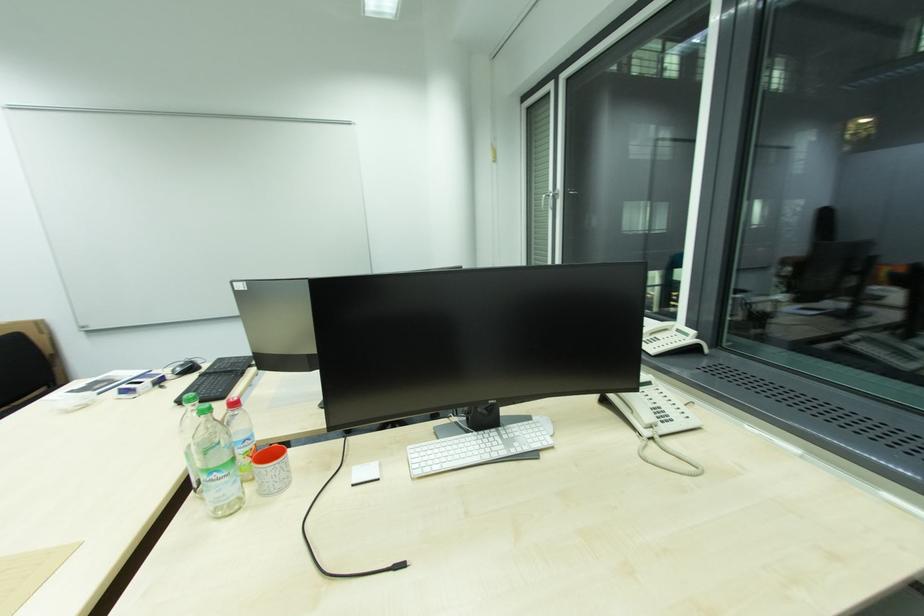
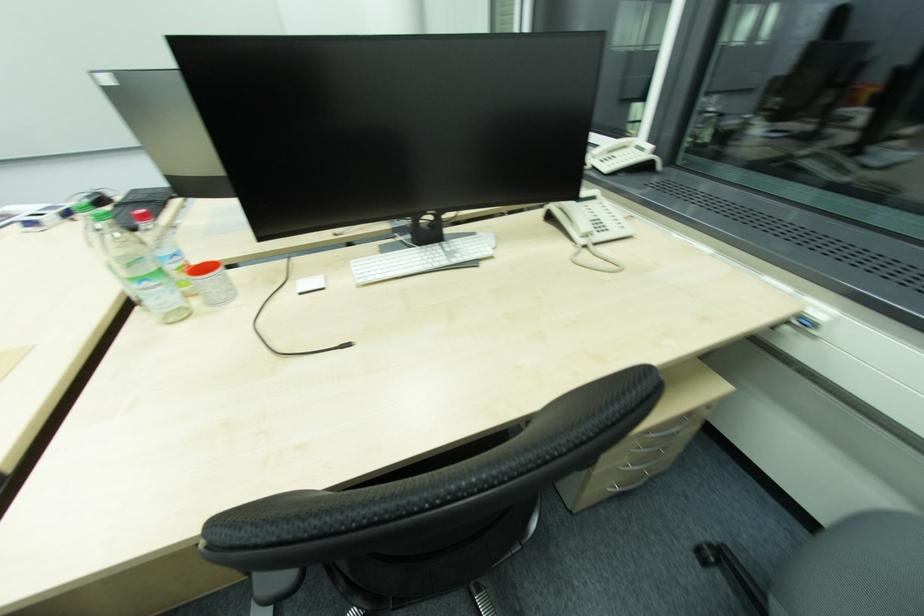
Question: In a continuous first-person perspective shot, in which direction is the camera moving?

Choices:
 (A) Left
 (B) Right
 (C) Forward
 (D) Backward

Answer: (B)